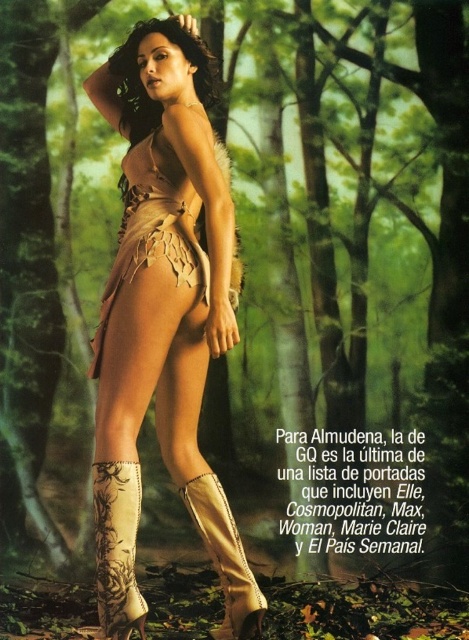
Who is shorter, leather/embroidered cowboy boot at lower center or matte beige dress at center?

With less height is matte beige dress at center.

Between leather/embroidered cowboy boot at lower center and matte beige dress at center, which one appears on the left side from the viewer's perspective?

matte beige dress at center is more to the left.

From the picture: Who is more distant from viewer, (203, 484) or (158, 116)?

Positioned behind is point (158, 116).

The width and height of the screenshot is (469, 640). I want to click on leather/embroidered cowboy boot at lower center, so click(225, 557).

Can you confirm if leather boots at lower center is positioned to the left of matte beige dress at center?

In fact, leather boots at lower center is to the right of matte beige dress at center.

Who is shorter, leather boots at lower center or matte beige dress at center?

matte beige dress at center

Which is behind, point (168, 237) or point (149, 33)?

Positioned behind is point (149, 33).

Where is `leather boots at lower center`? This screenshot has height=640, width=469. leather boots at lower center is located at coordinates (164, 314).

Does point (134, 522) come farther from viewer compared to point (100, 538)?

Yes.

Who is higher up, leather boots at lower center or beige leather cowboy boot at lower center?

leather boots at lower center

Find the location of `leather boots at lower center`. leather boots at lower center is located at coordinates (164, 314).

The width and height of the screenshot is (469, 640). What are the coordinates of `leather boots at lower center` in the screenshot? It's located at click(164, 314).